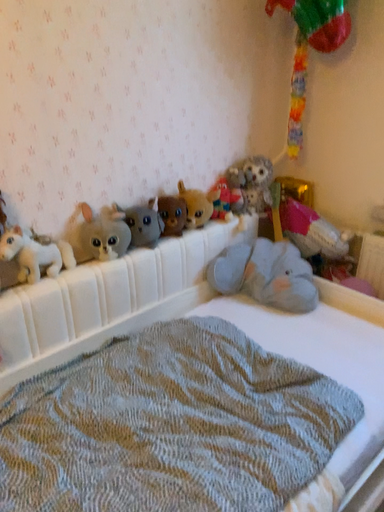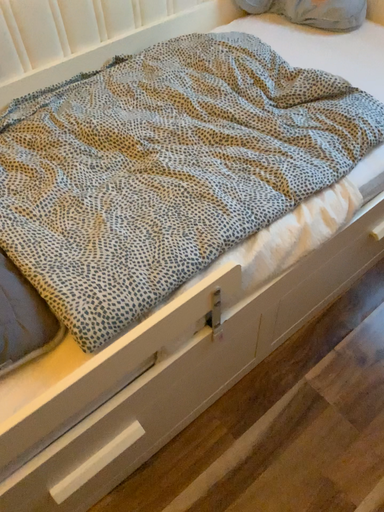
Question: How did the camera likely rotate when shooting the video?

Choices:
 (A) rotated downward
 (B) rotated upward

Answer: (A)